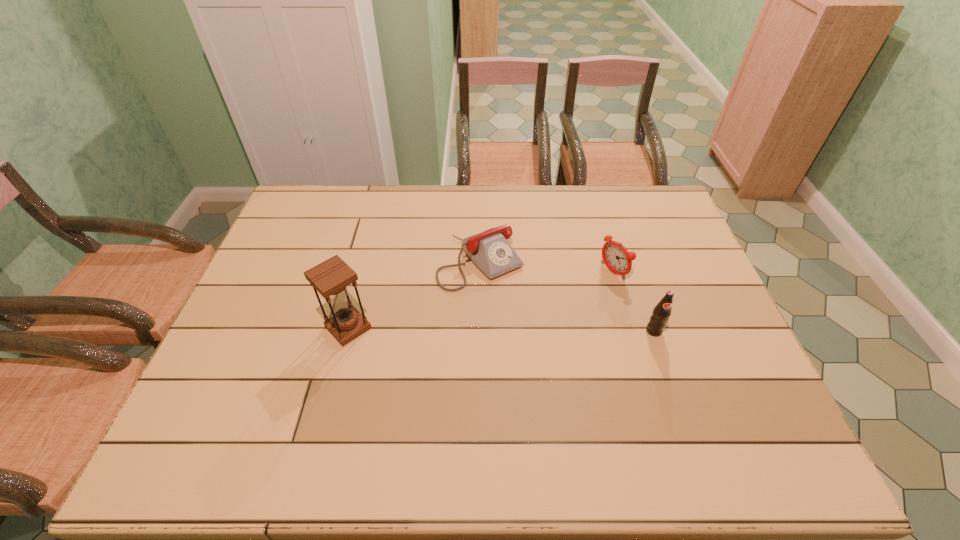
Locate an element on the screen. free space on the desktop that is between the tallest object and the pop and is positioned on the front-facing side of the alarm clock is located at coordinates (516, 329).

This screenshot has width=960, height=540. I want to click on vacant space on the desktop that is between the leftmost object and the third shortest object and is positioned on the dial of the third object from right to left, so click(538, 329).